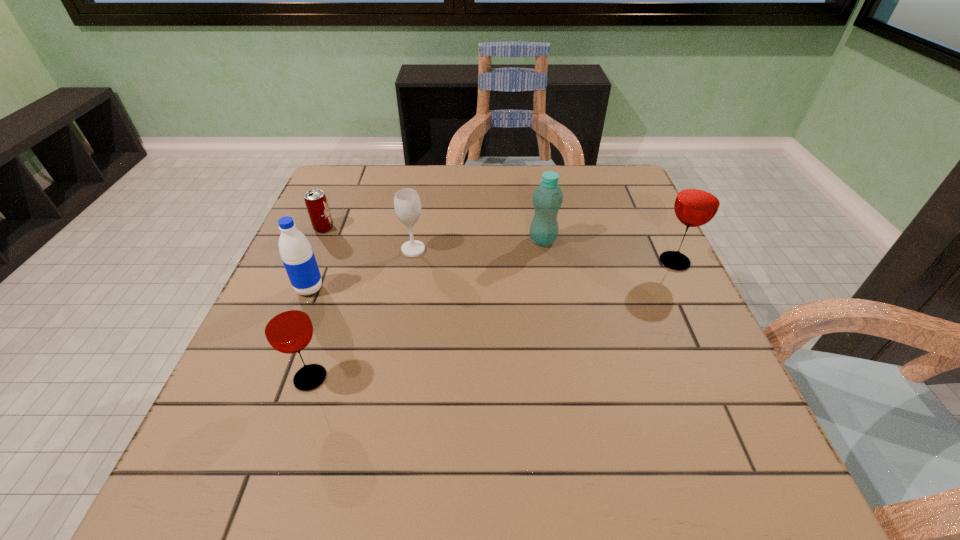
The image size is (960, 540). What are the coordinates of `free space at the near left corner of the desktop` in the screenshot? It's located at (293, 414).

Where is `vacant point located between the left glass and the rightmost object`? The image size is (960, 540). vacant point located between the left glass and the rightmost object is located at coordinates (492, 320).

Identify the location of free space between the beer can and the farther glass. (499, 245).

I want to click on vacant area between the fourth object from left to right and the nearest object, so click(x=362, y=314).

I want to click on empty space between the left water bottle and the farther glass, so click(492, 275).

At what (x,y) coordinates should I click in order to perform the action: click on free space that is in between the farther water bottle and the fifth tallest object. Please return your answer as a coordinate pair (x, y). The width and height of the screenshot is (960, 540). Looking at the image, I should click on (478, 245).

You are a GUI agent. You are given a task and a screenshot of the screen. Output one action in this format:
    pyautogui.click(x=<x>, y=<y>)
    Task: Click on the free point between the tallest object and the farther water bottle
    
    Given the screenshot: What is the action you would take?
    pyautogui.click(x=609, y=251)

You are a GUI agent. You are given a task and a screenshot of the screen. Output one action in this format:
    pyautogui.click(x=<x>, y=<y>)
    Task: Click on the free point between the third object from right to left and the left water bottle
    The image size is (960, 540).
    Given the screenshot: What is the action you would take?
    pyautogui.click(x=361, y=269)

The width and height of the screenshot is (960, 540). Find the location of `empty location between the second object from right to left and the rightmost object`. empty location between the second object from right to left and the rightmost object is located at coordinates (609, 251).

Locate an element on the screen. This screenshot has height=540, width=960. free spot between the shortest object and the left water bottle is located at coordinates (317, 259).